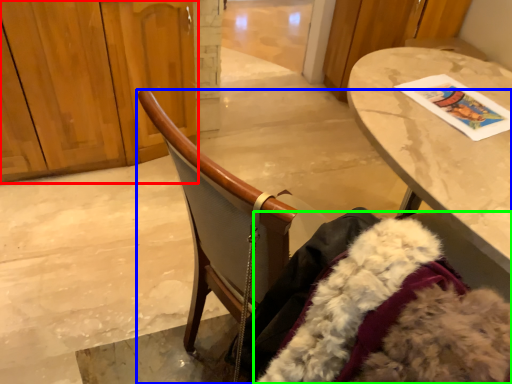
Question: Based on their relative distances, which object is nearer to dresser (highlighted by a red box)? Choose from chair (highlighted by a blue box) and fur coat (highlighted by a green box).

Choices:
 (A) chair
 (B) fur coat

Answer: (A)